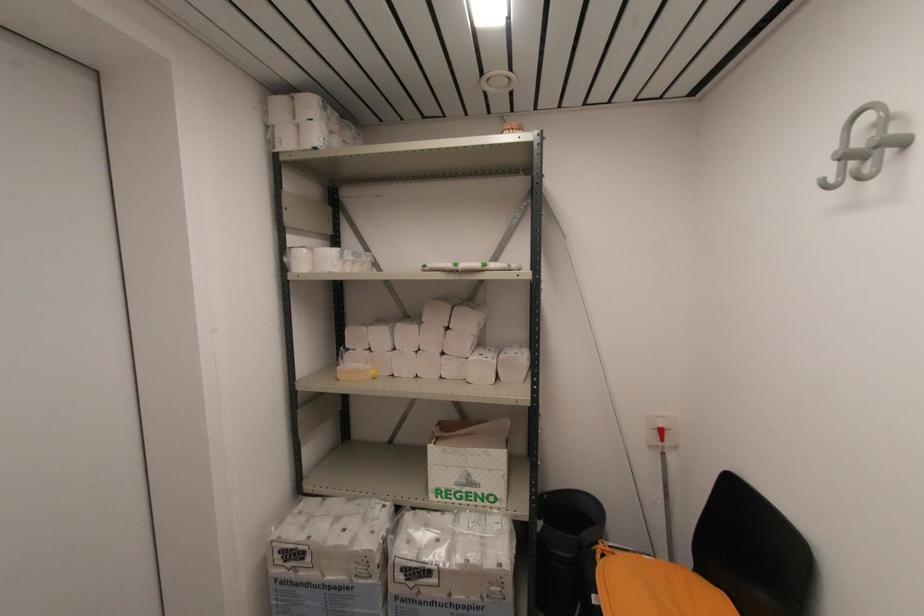
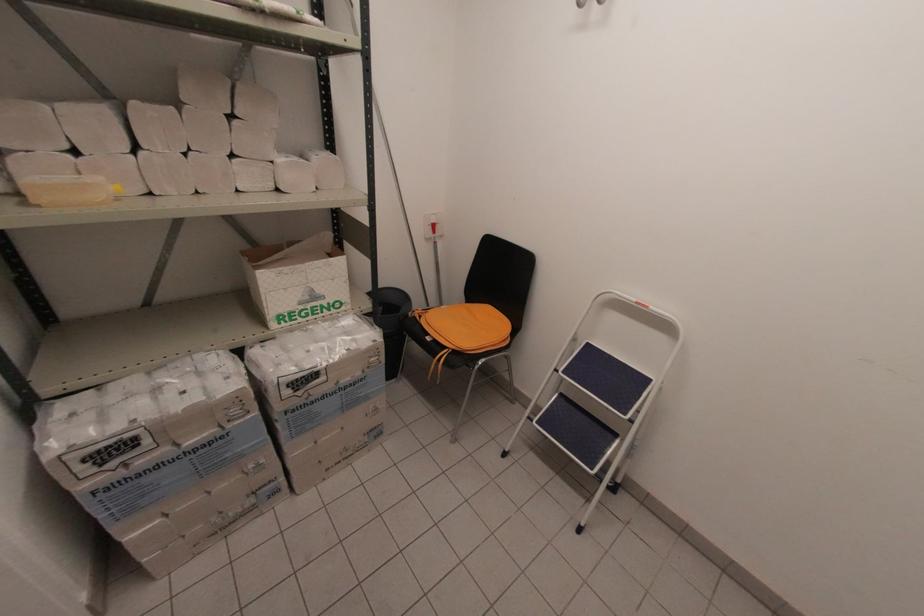
Where in the second image is the point corresponding to point 281,553 from the first image?

(84, 463)